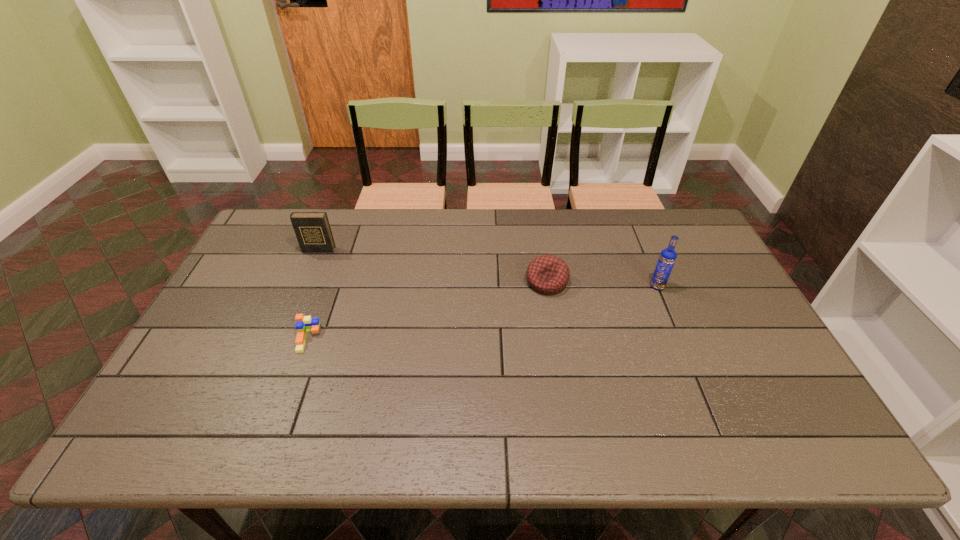
Locate an element on the screen. the rightmost object is located at coordinates (667, 258).

What are the coordinates of `vodka` in the screenshot? It's located at (667, 258).

You are a GUI agent. You are given a task and a screenshot of the screen. Output one action in this format:
    pyautogui.click(x=<x>, y=<y>)
    Task: Click on the second tallest object
    
    Given the screenshot: What is the action you would take?
    point(312,229)

The width and height of the screenshot is (960, 540). What are the coordinates of `the farthest object` in the screenshot? It's located at (312, 229).

At what (x,y) coordinates should I click in order to perform the action: click on the third tallest object. Please return your answer as a coordinate pair (x, y). Image resolution: width=960 pixels, height=540 pixels. Looking at the image, I should click on (547, 274).

This screenshot has height=540, width=960. I want to click on the third object from left to right, so click(x=547, y=274).

The image size is (960, 540). Find the location of `Lego`. Lego is located at coordinates (304, 324).

The image size is (960, 540). I want to click on the shortest object, so click(304, 324).

The height and width of the screenshot is (540, 960). Find the location of `vacant space located 0.160m on the right of the vodka`. vacant space located 0.160m on the right of the vodka is located at coordinates (718, 286).

Where is `free space located 0.250m on the front cover of the third shortest object`? Image resolution: width=960 pixels, height=540 pixels. free space located 0.250m on the front cover of the third shortest object is located at coordinates (294, 309).